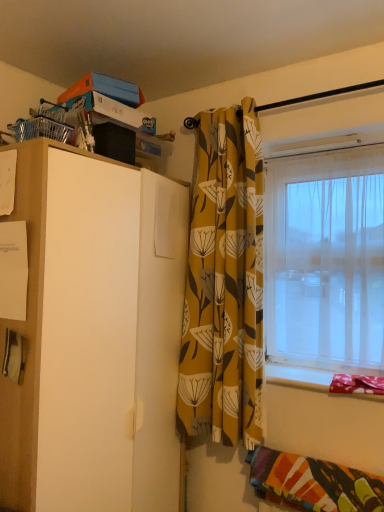
Identify the location of free space above transparent plastic window at right (from a real-world perspective). (305, 156).